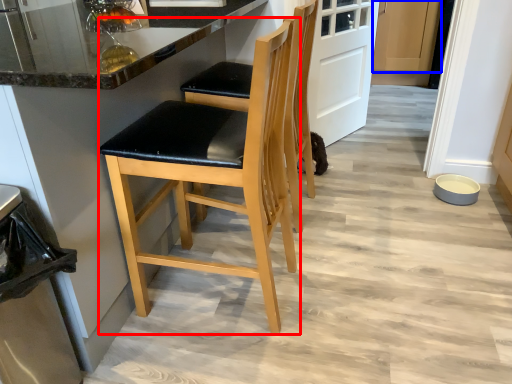
Question: Which of the following is the closest to the observer, chair (highlighted by a red box) or cabinetry (highlighted by a blue box)?

Choices:
 (A) chair
 (B) cabinetry

Answer: (A)